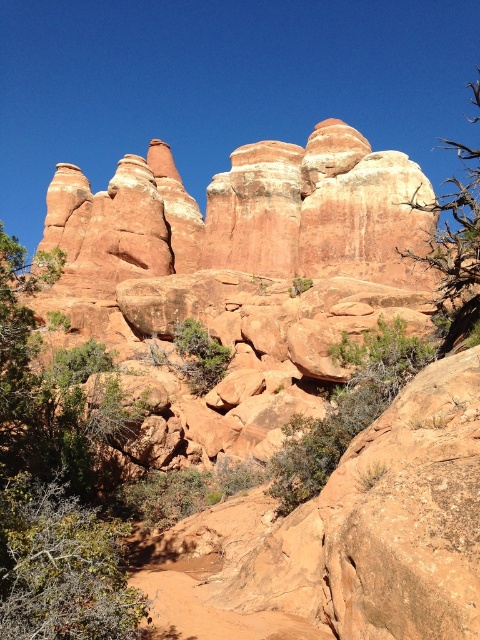
Question: Which point is closer to the camera taking this photo?

Choices:
 (A) (81, 554)
 (B) (95, 596)
 (C) (338, 449)

Answer: (B)

Question: Among these points, which one is nearest to the camera?

Choices:
 (A) (84, 614)
 (B) (424, 358)

Answer: (A)

Question: Does rustic sandstone rock formation at center lie in front of green leafy bush at lower left?

Choices:
 (A) no
 (B) yes

Answer: (A)

Question: Does green leafy shrub at center appear on the right side of brown textured tree at right?

Choices:
 (A) yes
 (B) no

Answer: (B)

Question: Is rustic sandstone rock formation at center below brown textured tree at right?

Choices:
 (A) yes
 (B) no

Answer: (A)

Question: Which is farther from the rustic sandstone rock formation at center?

Choices:
 (A) green leafy shrub at left
 (B) green leafy bush at lower left
 (C) green leafy shrub at center
 (D) brown textured tree at right

Answer: (B)